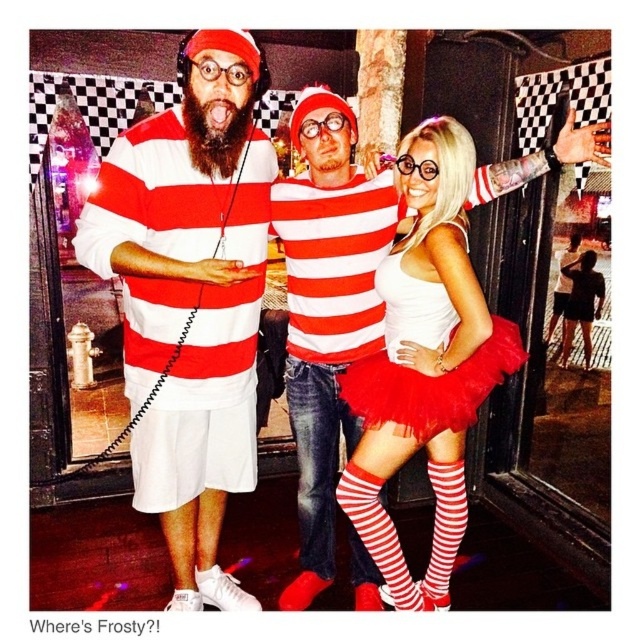
Locate an element on the screen. This screenshot has width=640, height=640. matte white shorts at center is located at coordinates (189, 298).

Does matte white shorts at center have a lesser width compared to red tulle skirt at center?

Yes.

Does matte white shorts at center come in front of red tulle skirt at center?

Yes, it is in front of red tulle skirt at center.

Who is more distant from viewer, (x=218, y=336) or (x=470, y=365)?

Positioned behind is point (x=218, y=336).

Locate an element on the screen. matte white shorts at center is located at coordinates (189, 298).

Between white tulle skirt at center and red tulle skirt at center, which one appears on the right side from the viewer's perspective?

Positioned to the right is red tulle skirt at center.

Is white tulle skirt at center in front of red tulle skirt at center?

Yes, it is.

Is point (420, 170) closer to viewer compared to point (429, 381)?

No.

Where is `white tulle skirt at center`? white tulle skirt at center is located at coordinates (426, 364).